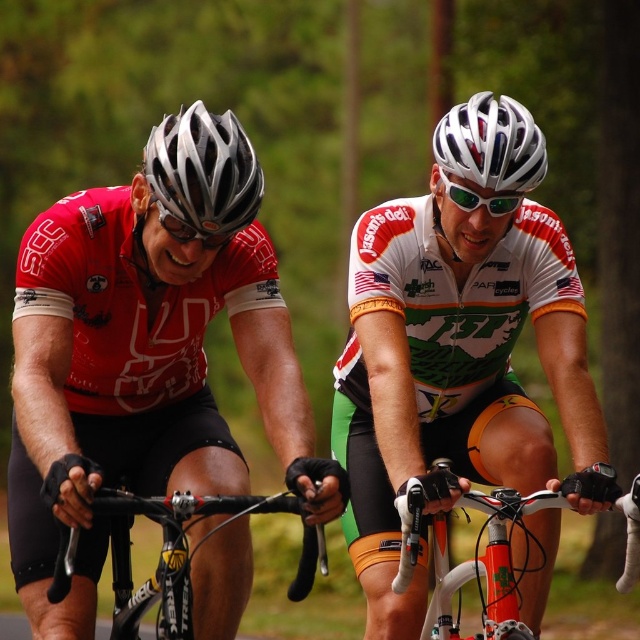
Question: Estimate the real-world distances between objects in this image. Which object is closer to the matte black helmet at center?

Choices:
 (A) black matte bicycle handlebars at center
 (B) silver matte bicycle helmet at upper left

Answer: (A)

Question: Can you confirm if white glossy bicycle handlebars at center is positioned to the left of shiny silver helmet at upper center?

Choices:
 (A) no
 (B) yes

Answer: (A)

Question: Which object is the closest to the white glossy bicycle handlebars at center?

Choices:
 (A) matte black helmet at center
 (B) white glossy helmet at center

Answer: (B)

Question: Which object is closer to the camera taking this photo?

Choices:
 (A) white glossy bicycle handlebars at center
 (B) black matte bicycle handlebars at center
 (C) white glossy helmet at center
 (D) shiny silver helmet at upper center

Answer: (B)

Question: Where is white glossy helmet at center located in relation to shiny silver helmet at upper center in the image?

Choices:
 (A) above
 (B) below

Answer: (B)

Question: Does white glossy bicycle handlebars at center have a larger size compared to black matte bicycle handlebars at center?

Choices:
 (A) no
 (B) yes

Answer: (B)